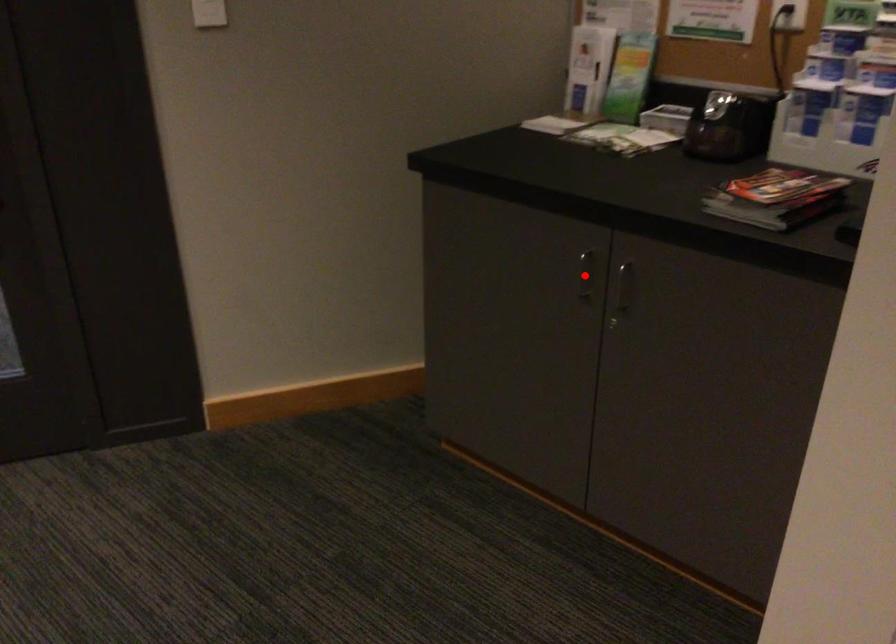
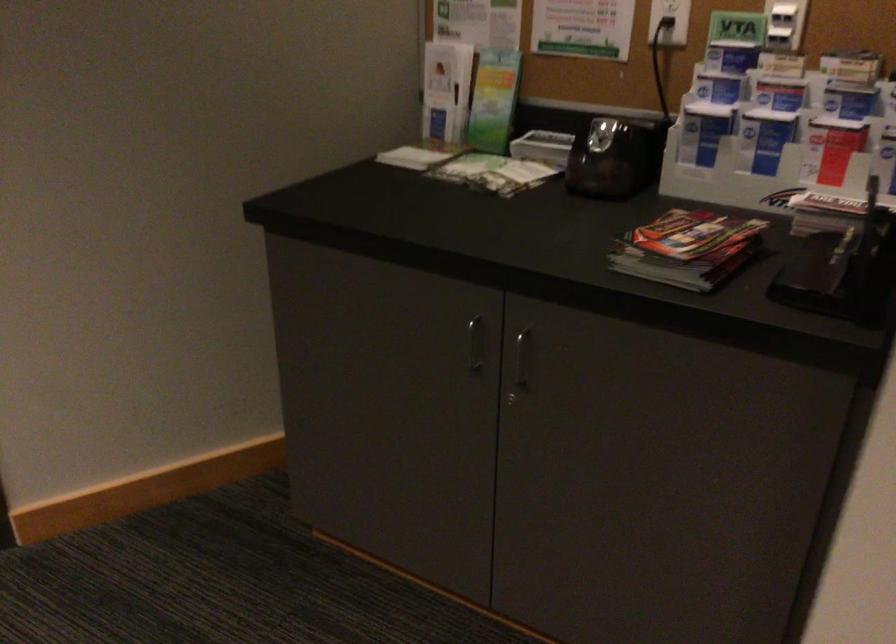
Question: I am providing you with two images of the same scene from different viewpoints. Given a red point in image1, look at the same physical point in image2. Is it:

Choices:
 (A) Closer to the viewpoint
 (B) Farther from the viewpoint

Answer: (A)